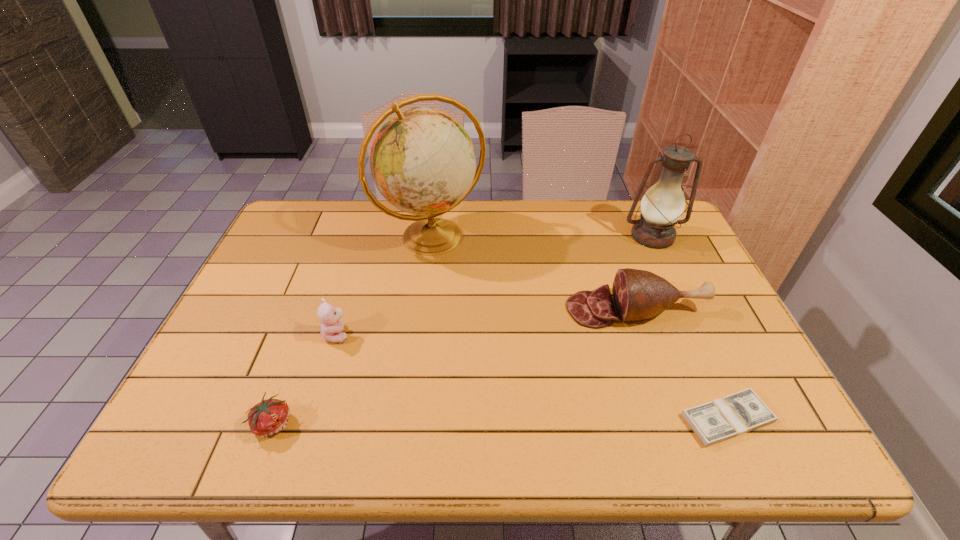
Where is `vacant point that satisfies the following two spatial constraints: 1. at the sliced end of the ham; 2. on the front side of the fifth tallest object`? The image size is (960, 540). vacant point that satisfies the following two spatial constraints: 1. at the sliced end of the ham; 2. on the front side of the fifth tallest object is located at coordinates (676, 423).

Find the location of a particular element. This screenshot has width=960, height=540. free spot that satisfies the following two spatial constraints: 1. at the face of the second object from left to right; 2. on the left side of the dollar is located at coordinates (x=311, y=419).

Identify the location of vacant region that satisfies the following two spatial constraints: 1. on the back side of the oil lamp; 2. on the left side of the dollar. (645, 237).

In order to click on free space that satisfies the following two spatial constraints: 1. on the back side of the tallest object; 2. on the left side of the oil lamp in this screenshot , I will do `click(432, 237)`.

You are a GUI agent. You are given a task and a screenshot of the screen. Output one action in this format:
    pyautogui.click(x=<x>, y=<y>)
    Task: Click on the vacant region that satisfies the following two spatial constraints: 1. at the face of the teddy bear; 2. on the front side of the leftmost object
    The width and height of the screenshot is (960, 540).
    Given the screenshot: What is the action you would take?
    pyautogui.click(x=310, y=423)